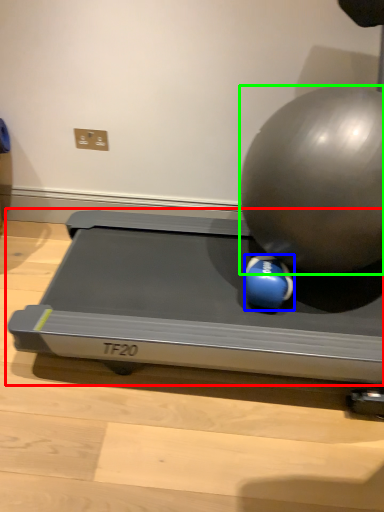
Question: Considering the real-world distances, which object is closest to treadmill (highlighted by a red box)? ball (highlighted by a blue box) or ball (highlighted by a green box).

Choices:
 (A) ball
 (B) ball

Answer: (A)